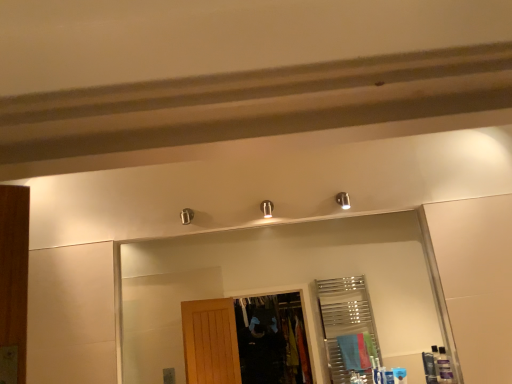
Question: Can you confirm if blue plastic toiletry at lower right, arranged as the third toiletry when viewed from the right, is smaller than translucent plastic bottles at lower right, which is counted as the 3th toiletry, starting from the left?

Choices:
 (A) no
 (B) yes

Answer: (B)

Question: Considering the relative positions of blue plastic toiletry at lower right, the 1th toiletry viewed from the left, and translucent plastic bottles at lower right, which is counted as the 3th toiletry, starting from the left, in the image provided, is blue plastic toiletry at lower right, the 1th toiletry viewed from the left, to the right of translucent plastic bottles at lower right, which is counted as the 3th toiletry, starting from the left, from the viewer's perspective?

Choices:
 (A) yes
 (B) no

Answer: (B)

Question: From the image's perspective, is blue plastic toiletry at lower right, the 1th toiletry viewed from the left, on top of translucent plastic bottles at lower right, which is counted as the 3th toiletry, starting from the left?

Choices:
 (A) yes
 (B) no

Answer: (B)

Question: From a real-world perspective, is blue plastic toiletry at lower right, the 1th toiletry viewed from the left, on translucent plastic bottles at lower right, which is counted as the 3th toiletry, starting from the left?

Choices:
 (A) yes
 (B) no

Answer: (B)

Question: Considering the relative sizes of blue plastic toiletry at lower right, the 1th toiletry viewed from the left, and translucent plastic bottles at lower right, the 1th toiletry in the right-to-left sequence, in the image provided, is blue plastic toiletry at lower right, the 1th toiletry viewed from the left, wider than translucent plastic bottles at lower right, the 1th toiletry in the right-to-left sequence,?

Choices:
 (A) yes
 (B) no

Answer: (B)

Question: Considering the positions of clear glass mirror at upper center and translucent plastic bottles at lower right, the 1th toiletry in the right-to-left sequence, in the image, is clear glass mirror at upper center bigger or smaller than translucent plastic bottles at lower right, the 1th toiletry in the right-to-left sequence,?

Choices:
 (A) small
 (B) big

Answer: (B)

Question: Is clear glass mirror at upper center in front of or behind translucent plastic bottles at lower right, which is counted as the 3th toiletry, starting from the left, in the image?

Choices:
 (A) behind
 (B) front

Answer: (A)

Question: From a real-world perspective, relative to translucent plastic bottles at lower right, which is counted as the 3th toiletry, starting from the left, is clear glass mirror at upper center vertically above or below?

Choices:
 (A) above
 (B) below

Answer: (A)

Question: From the image's perspective, relative to translucent plastic bottles at lower right, the 1th toiletry in the right-to-left sequence, is clear glass mirror at upper center above or below?

Choices:
 (A) below
 (B) above

Answer: (B)

Question: Considering the positions of matte black toiletry at lower right, arranged as the 2th toiletry when viewed from the right, and translucent plastic bottles at lower right, the 1th toiletry in the right-to-left sequence, in the image, is matte black toiletry at lower right, arranged as the 2th toiletry when viewed from the right, taller or shorter than translucent plastic bottles at lower right, the 1th toiletry in the right-to-left sequence,?

Choices:
 (A) short
 (B) tall

Answer: (A)

Question: Is matte black toiletry at lower right, which is the second toiletry from left to right, to the left or to the right of translucent plastic bottles at lower right, which is counted as the 3th toiletry, starting from the left, in the image?

Choices:
 (A) left
 (B) right

Answer: (A)

Question: Is matte black toiletry at lower right, which is the second toiletry from left to right, wider or thinner than translucent plastic bottles at lower right, which is counted as the 3th toiletry, starting from the left?

Choices:
 (A) wide
 (B) thin

Answer: (B)

Question: Is matte black toiletry at lower right, arranged as the 2th toiletry when viewed from the right, bigger or smaller than translucent plastic bottles at lower right, the 1th toiletry in the right-to-left sequence?

Choices:
 (A) small
 (B) big

Answer: (A)

Question: Do you think clear glass mirror at upper center is within matte black toiletry at lower right, arranged as the 2th toiletry when viewed from the right, or outside of it?

Choices:
 (A) outside
 (B) inside

Answer: (A)

Question: Is clear glass mirror at upper center wider or thinner than matte black toiletry at lower right, arranged as the 2th toiletry when viewed from the right?

Choices:
 (A) thin
 (B) wide

Answer: (B)